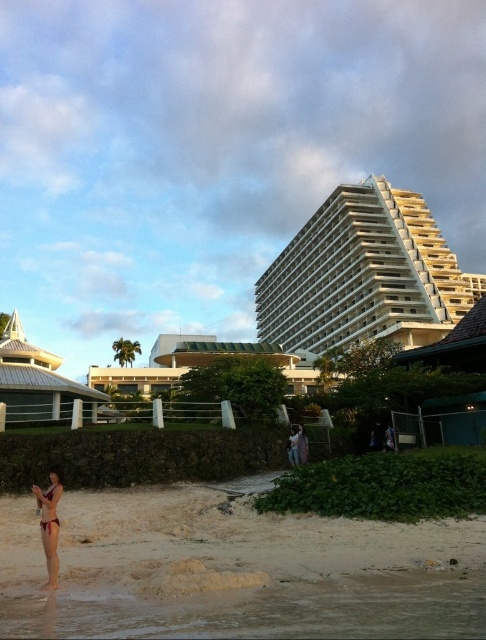
Is beige sand at lower left to the left of white textured dome at left from the viewer's perspective?

No, beige sand at lower left is not to the left of white textured dome at left.

Is beige sand at lower left smaller than white textured dome at left?

Yes, beige sand at lower left is smaller than white textured dome at left.

Where is `beige sand at lower left`? The width and height of the screenshot is (486, 640). beige sand at lower left is located at coordinates (236, 570).

Can you confirm if clear water at lower left is bigger than white textured dome at left?

No, clear water at lower left is not bigger than white textured dome at left.

Can you confirm if clear water at lower left is smaller than white textured dome at left?

Correct, clear water at lower left occupies less space than white textured dome at left.

Does point (408, 572) lie in front of point (10, 392)?

Yes.

Locate an element on the screen. This screenshot has height=640, width=486. clear water at lower left is located at coordinates (268, 611).

Who is positioned more to the right, white textured building at upper right or white textured dome at left?

From the viewer's perspective, white textured building at upper right appears more on the right side.

Locate an element on the screen. Image resolution: width=486 pixels, height=640 pixels. white textured building at upper right is located at coordinates (364, 275).

I want to click on white textured building at upper right, so click(364, 275).